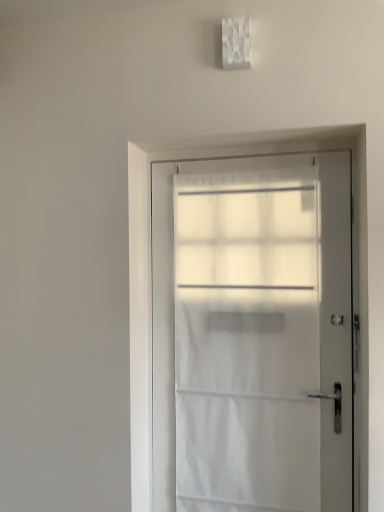
Where is `white matte door at center`? This screenshot has height=512, width=384. white matte door at center is located at coordinates (253, 333).

What do you see at coordinates (253, 333) in the screenshot? The width and height of the screenshot is (384, 512). I see `white matte door at center` at bounding box center [253, 333].

What is the approximate width of white matte door at center?

3.25 inches.

Find the location of `white matte door at center`. white matte door at center is located at coordinates (253, 333).